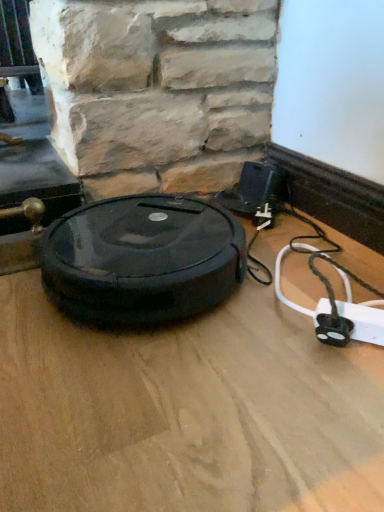
Question: Is black rubber robot vacuum cleaner at center wider than white plastic extension cord at lower right?

Choices:
 (A) no
 (B) yes

Answer: (B)

Question: Is black rubber robot vacuum cleaner at center looking in the opposite direction of white plastic extension cord at lower right?

Choices:
 (A) no
 (B) yes

Answer: (A)

Question: From a real-world perspective, is black rubber robot vacuum cleaner at center located beneath white plastic extension cord at lower right?

Choices:
 (A) yes
 (B) no

Answer: (B)

Question: Is black rubber robot vacuum cleaner at center not near white plastic extension cord at lower right?

Choices:
 (A) no
 (B) yes

Answer: (A)

Question: Does black rubber robot vacuum cleaner at center have a greater height compared to white plastic extension cord at lower right?

Choices:
 (A) yes
 (B) no

Answer: (A)

Question: Considering the positions of point (114, 295) and point (379, 287), is point (114, 295) closer or farther from the camera than point (379, 287)?

Choices:
 (A) farther
 (B) closer

Answer: (B)

Question: Would you say black rubber robot vacuum cleaner at center is inside or outside wooden floor at center?

Choices:
 (A) inside
 (B) outside

Answer: (B)

Question: From the image's perspective, is black rubber robot vacuum cleaner at center positioned above or below wooden floor at center?

Choices:
 (A) above
 (B) below

Answer: (B)

Question: From a real-world perspective, is black rubber robot vacuum cleaner at center positioned above or below wooden floor at center?

Choices:
 (A) above
 (B) below

Answer: (A)

Question: From a real-world perspective, is wooden floor at center positioned above or below black rubber robot vacuum cleaner at center?

Choices:
 (A) below
 (B) above

Answer: (A)

Question: In terms of width, does wooden floor at center look wider or thinner when compared to black rubber robot vacuum cleaner at center?

Choices:
 (A) wide
 (B) thin

Answer: (A)

Question: Is point (311, 478) closer or farther from the camera than point (102, 263)?

Choices:
 (A) closer
 (B) farther

Answer: (A)

Question: From their relative heights in the image, would you say wooden floor at center is taller or shorter than black rubber robot vacuum cleaner at center?

Choices:
 (A) tall
 (B) short

Answer: (B)

Question: From the image's perspective, is white plastic extension cord at lower right positioned above or below black rubber robot vacuum cleaner at center?

Choices:
 (A) below
 (B) above

Answer: (A)

Question: From a real-world perspective, is white plastic extension cord at lower right positioned above or below black rubber robot vacuum cleaner at center?

Choices:
 (A) above
 (B) below

Answer: (B)